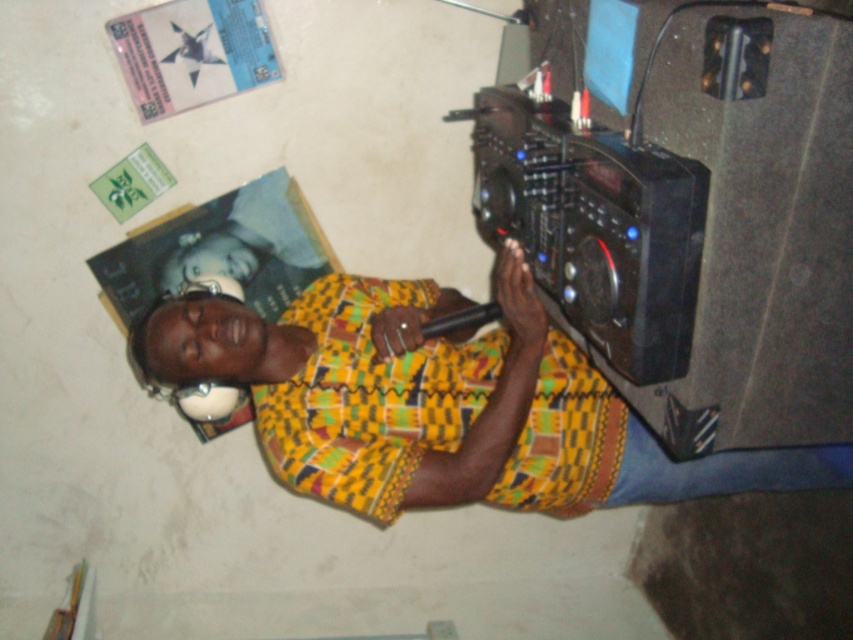
Question: Can you confirm if black matte speaker at right is positioned above yellow printed shirt at center?

Choices:
 (A) no
 (B) yes

Answer: (B)

Question: Is black matte speaker at right to the left of black plastic video camera at right from the viewer's perspective?

Choices:
 (A) yes
 (B) no

Answer: (B)

Question: Considering the real-world distances, which object is closest to the black matte speaker at right?

Choices:
 (A) yellow printed shirt at center
 (B) black plastic video camera at right

Answer: (B)

Question: Is black matte speaker at right below black plastic video camera at right?

Choices:
 (A) no
 (B) yes

Answer: (A)

Question: Which of these objects is positioned farthest from the black matte speaker at right?

Choices:
 (A) yellow printed shirt at center
 (B) black plastic video camera at right

Answer: (A)

Question: Based on their relative distances, which object is farther from the black plastic video camera at right?

Choices:
 (A) yellow printed shirt at center
 (B) black matte speaker at right

Answer: (A)